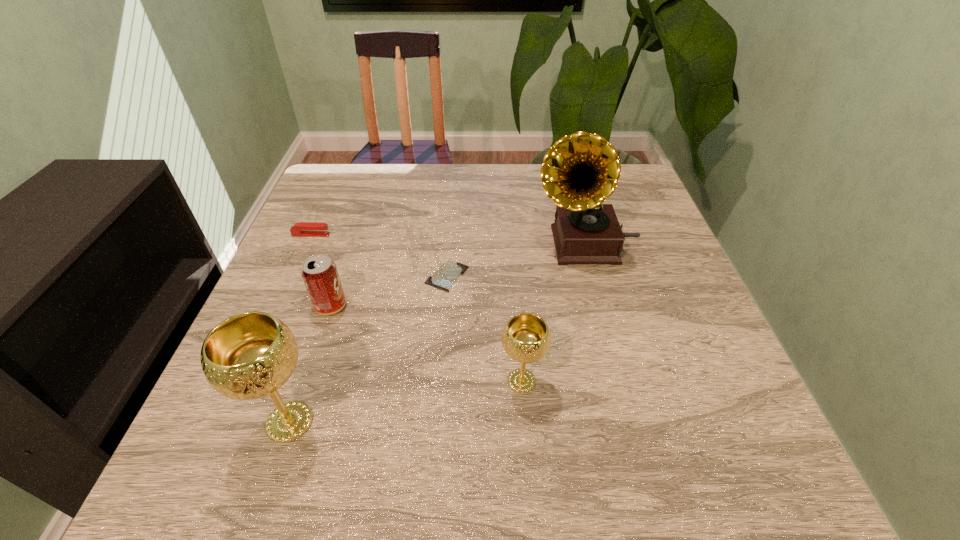
This screenshot has height=540, width=960. In order to click on free location that satisfies the following two spatial constraints: 1. from the horn of the phonograph record; 2. on the front side of the soda can in this screenshot , I will do `click(601, 306)`.

Locate an element on the screen. The height and width of the screenshot is (540, 960). blank area in the image that satisfies the following two spatial constraints: 1. from the horn of the tallest object; 2. on the front side of the identity card is located at coordinates (593, 276).

I want to click on vacant area that satisfies the following two spatial constraints: 1. on the front-facing side of the fourth object from left to right; 2. on the left side of the second shortest object, so click(293, 276).

You are a GUI agent. You are given a task and a screenshot of the screen. Output one action in this format:
    pyautogui.click(x=<x>, y=<y>)
    Task: Click on the free region that satisfies the following two spatial constraints: 1. on the back side of the second tallest object; 2. on the left side of the shorter chalice
    This screenshot has height=540, width=960.
    Given the screenshot: What is the action you would take?
    coord(303,381)

Locate an element on the screen. free space that satisfies the following two spatial constraints: 1. on the back side of the fifth object from left to right; 2. on the front-facing side of the fifth tallest object is located at coordinates (510, 235).

Locate an element on the screen. This screenshot has height=540, width=960. free point that satisfies the following two spatial constraints: 1. on the back side of the right chalice; 2. on the front-facing side of the stapler is located at coordinates (510, 235).